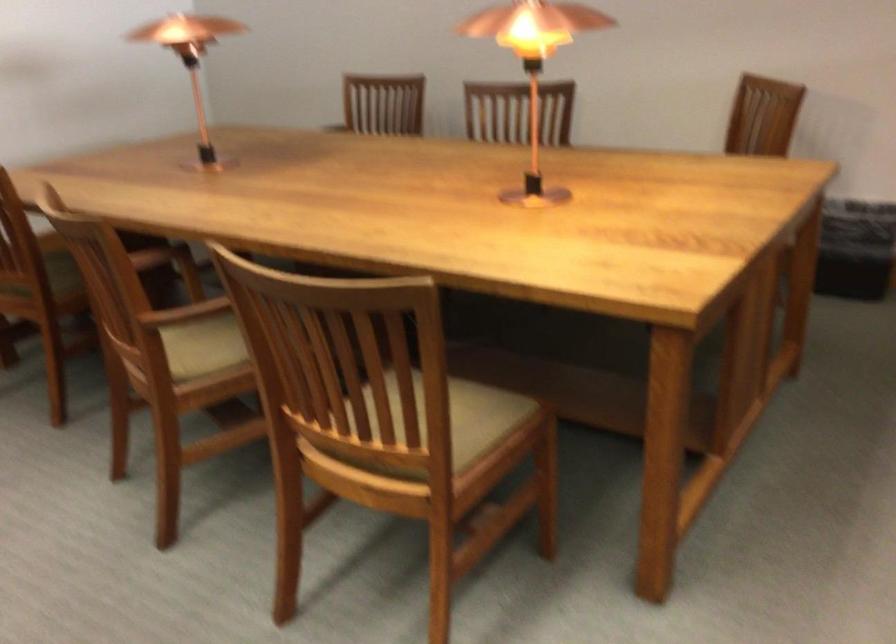
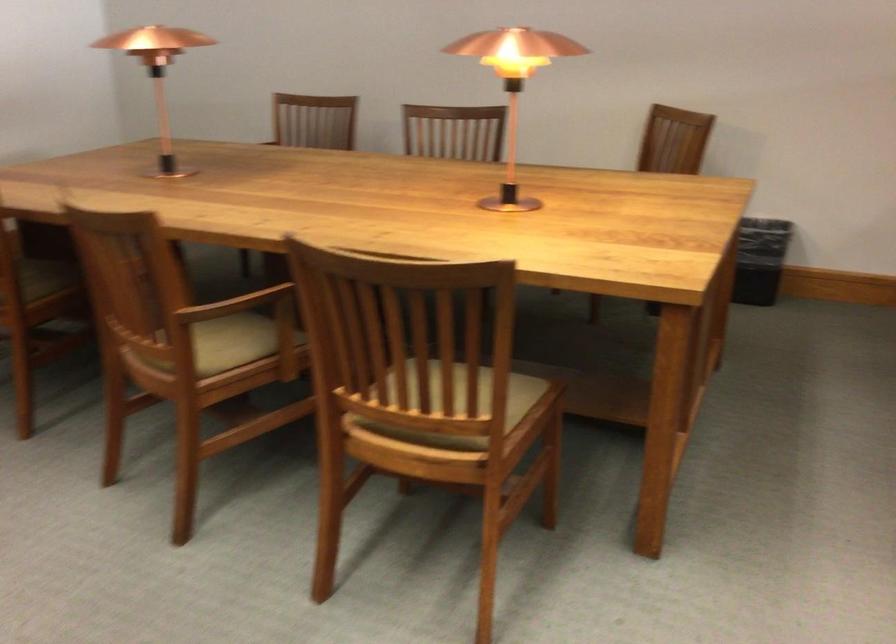
The point at (203, 310) is marked in the first image. Where is the corresponding point in the second image?

(236, 304)